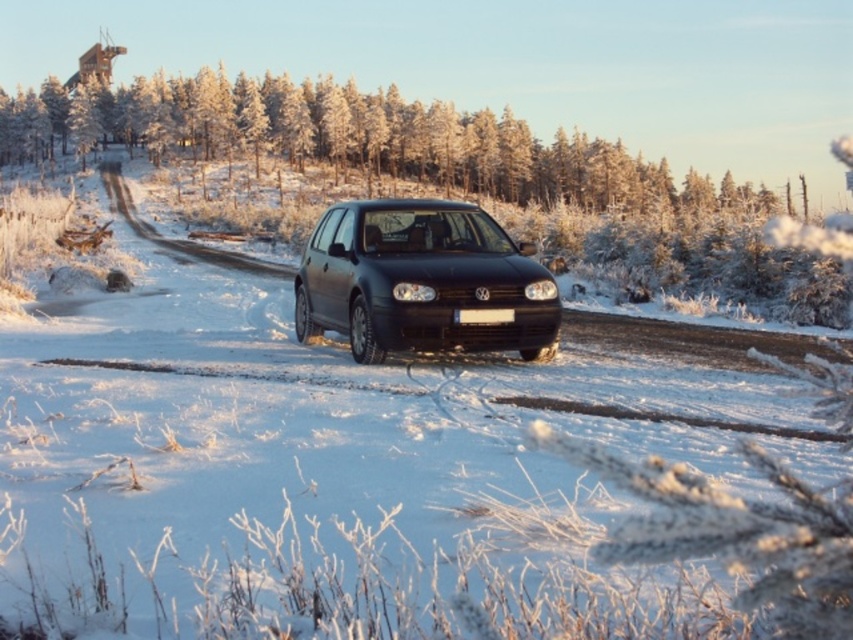
Question: Can you confirm if matte black car at center is positioned below white plastic license plate at center?

Choices:
 (A) no
 (B) yes

Answer: (A)

Question: Which point is closer to the camera?

Choices:
 (A) white plastic license plate at center
 (B) matte black car at center

Answer: (B)

Question: Does matte black car at center lie in front of white plastic license plate at center?

Choices:
 (A) yes
 (B) no

Answer: (A)

Question: Which object appears closest to the camera in this image?

Choices:
 (A) matte black car at center
 (B) white plastic license plate at center

Answer: (A)

Question: Is matte black car at center bigger than white plastic license plate at center?

Choices:
 (A) no
 (B) yes

Answer: (B)

Question: Which of the following is the farthest from the observer?

Choices:
 (A) white plastic license plate at center
 (B) matte black car at center

Answer: (A)